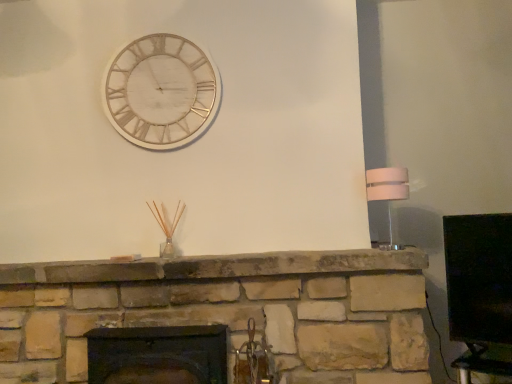
Where is `vacant space to the left of white glossy lampshade at right`? vacant space to the left of white glossy lampshade at right is located at coordinates (353, 247).